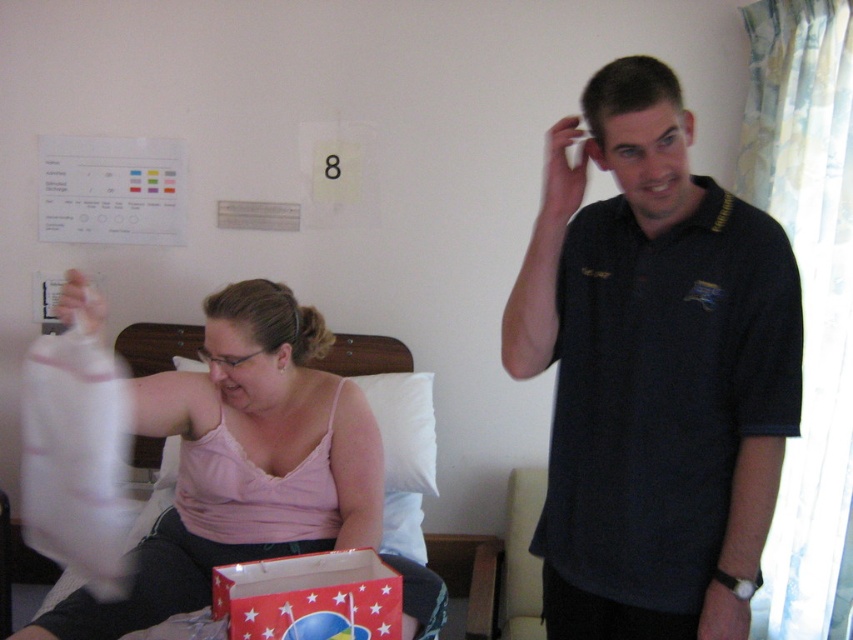
Question: Can you confirm if dark blue polo shirt at center is thinner than pink fabric bag at center?

Choices:
 (A) no
 (B) yes

Answer: (B)

Question: Which object is closer to the camera taking this photo?

Choices:
 (A) red paper bag at lower center
 (B) pink fabric bag at center

Answer: (A)

Question: Which of the following is the farthest from the observer?

Choices:
 (A) dark blue polo shirt at center
 (B) pink fabric bag at center

Answer: (B)

Question: Which object is closer to the camera taking this photo?

Choices:
 (A) red paper bag at lower center
 (B) pink fabric bag at center
 (C) dark blue polo shirt at center

Answer: (A)

Question: Does pink fabric bag at center appear under red paper bag at lower center?

Choices:
 (A) no
 (B) yes

Answer: (A)

Question: Is pink fabric bag at center smaller than red paper bag at lower center?

Choices:
 (A) yes
 (B) no

Answer: (B)